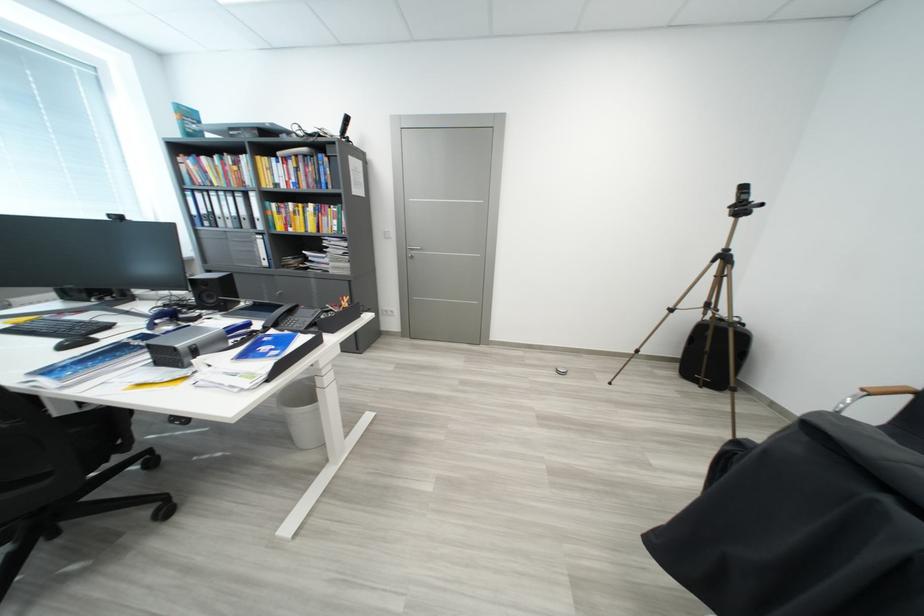
Image resolution: width=924 pixels, height=616 pixels. Find the location of `blue stapler`. blue stapler is located at coordinates (x=171, y=315).